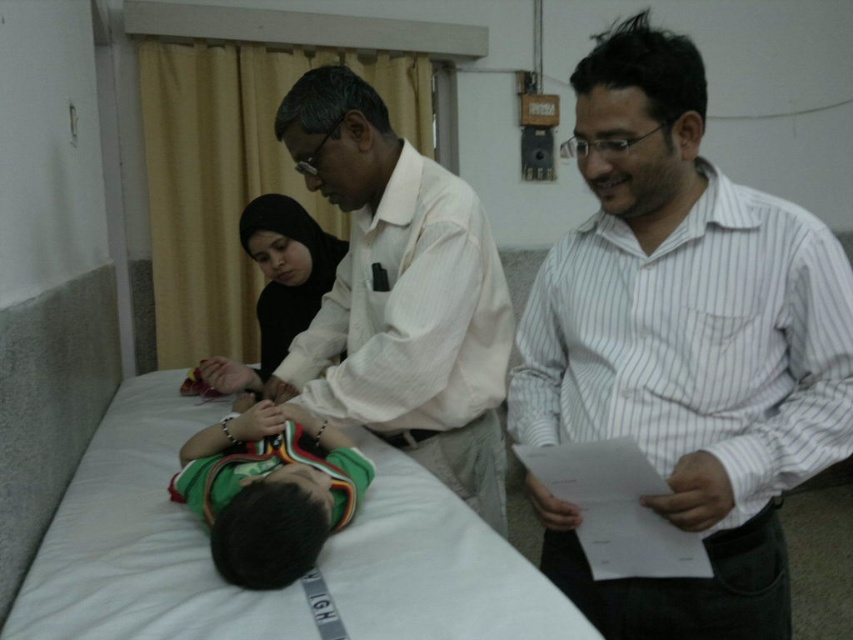
Is white fabric bed at center further to the viewer compared to green striped shirt at center?

No, it is not.

Is point (398, 552) behind point (202, 500)?

No, (398, 552) is in front of (202, 500).

Describe the element at coordinates (140, 541) in the screenshot. This screenshot has height=640, width=853. I see `white fabric bed at center` at that location.

You are a GUI agent. You are given a task and a screenshot of the screen. Output one action in this format:
    pyautogui.click(x=<x>, y=<y>)
    Task: Click on the white fabric bed at center
    The image size is (853, 640).
    Given the screenshot: What is the action you would take?
    pyautogui.click(x=140, y=541)

Who is taller, white fabric bed at center or matte black hijab at center?

Standing taller between the two is matte black hijab at center.

What do you see at coordinates (140, 541) in the screenshot? The height and width of the screenshot is (640, 853). I see `white fabric bed at center` at bounding box center [140, 541].

Find the location of a particular element. This screenshot has height=640, width=853. white fabric bed at center is located at coordinates (140, 541).

Does white striped shirt at center have a smaller size compared to green striped shirt at center?

No, white striped shirt at center is not smaller than green striped shirt at center.

Looking at this image, does white striped shirt at center come in front of green striped shirt at center?

Yes, white striped shirt at center is closer to the viewer.

Between point (653, 464) and point (219, 488), which one is positioned behind?

The point (219, 488) is behind.

Where is `white striped shirt at center`? The height and width of the screenshot is (640, 853). white striped shirt at center is located at coordinates (682, 346).